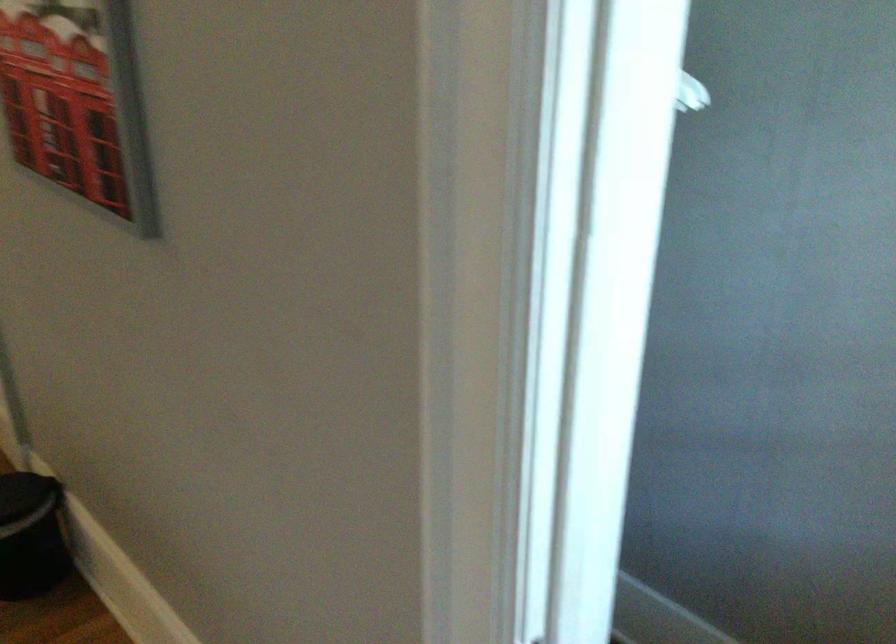
Which object does [30,536] point to?

It refers to a black trash can.